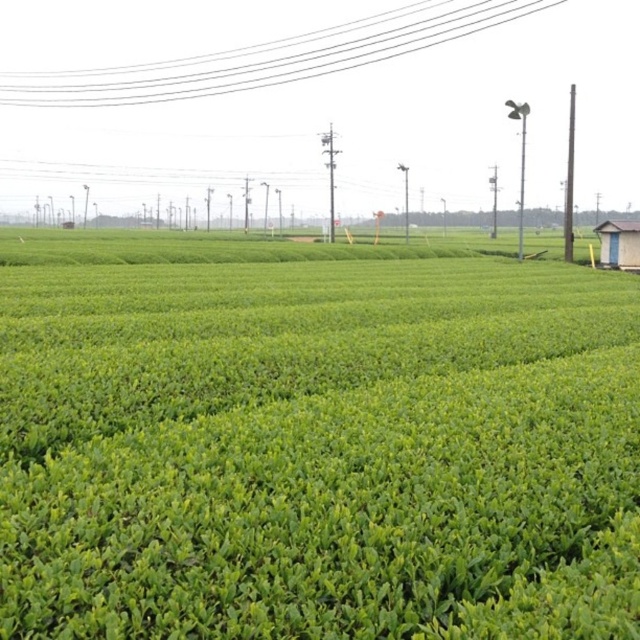
Question: Which of the following is the closest to the observer?

Choices:
 (A) white wire at upper center
 (B) green leafy field at center

Answer: (B)

Question: Can you confirm if white wire at upper center is thinner than white plastic hut at right?

Choices:
 (A) yes
 (B) no

Answer: (B)

Question: Which of the following is the closest to the observer?

Choices:
 (A) green leafy field at center
 (B) white wire at upper center

Answer: (A)

Question: Is green leafy field at center closer to the viewer compared to white plastic hut at right?

Choices:
 (A) no
 (B) yes

Answer: (B)

Question: Which point is farther to the camera?

Choices:
 (A) (385, 321)
 (B) (384, 13)

Answer: (B)

Question: Is the position of green leafy field at center less distant than that of white wire at upper center?

Choices:
 (A) no
 (B) yes

Answer: (B)